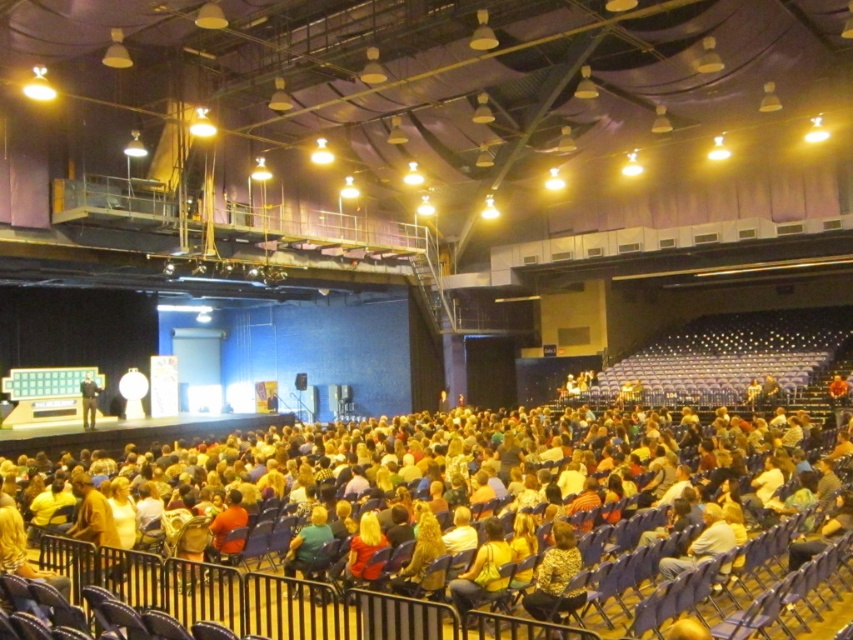
Can you confirm if floral-patterned shirt at center is positioned to the right of dark blue suit at center stage?

Indeed, floral-patterned shirt at center is positioned on the right side of dark blue suit at center stage.

Between floral-patterned shirt at center and dark blue suit at center stage, which one appears on the right side from the viewer's perspective?

From the viewer's perspective, floral-patterned shirt at center appears more on the right side.

The image size is (853, 640). Describe the element at coordinates (555, 577) in the screenshot. I see `floral-patterned shirt at center` at that location.

Locate an element on the screen. The width and height of the screenshot is (853, 640). floral-patterned shirt at center is located at coordinates (555, 577).

Which is in front, point (248, 525) or point (457, 595)?

Point (457, 595) is more forward.

Does multicolored fabric crowd at center appear on the right side of yellow shirt at center?

In fact, multicolored fabric crowd at center is to the left of yellow shirt at center.

Describe the element at coordinates (498, 570) in the screenshot. I see `multicolored fabric crowd at center` at that location.

The height and width of the screenshot is (640, 853). What are the coordinates of `multicolored fabric crowd at center` in the screenshot? It's located at (498, 570).

Who is positioned more to the right, multicolored fabric crowd at center or light brown leather jacket at center?

Positioned to the right is light brown leather jacket at center.

Which of these two, multicolored fabric crowd at center or light brown leather jacket at center, stands taller?

multicolored fabric crowd at center is taller.

Describe the element at coordinates (498, 570) in the screenshot. I see `multicolored fabric crowd at center` at that location.

The image size is (853, 640). I want to click on multicolored fabric crowd at center, so click(498, 570).